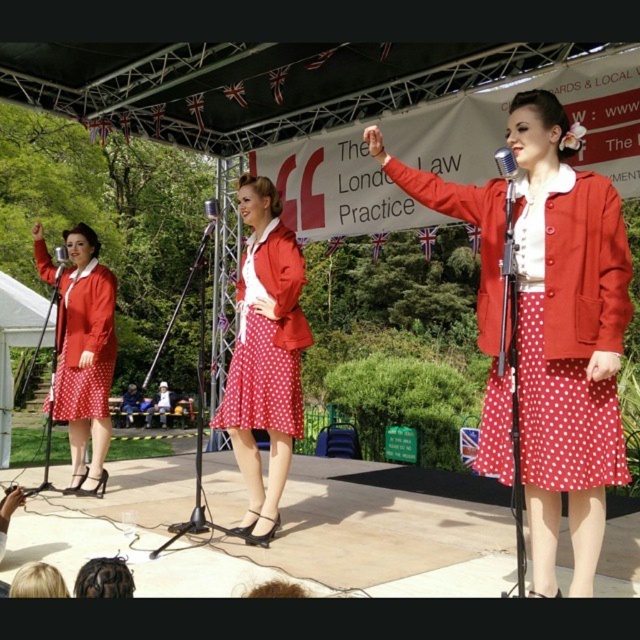
How much distance is there between matte red skirt at left and polka dot fabric dress at center?

matte red skirt at left and polka dot fabric dress at center are 1.65 meters apart.

Is matte red skirt at left wider than polka dot fabric dress at center?

Correct, the width of matte red skirt at left exceeds that of polka dot fabric dress at center.

Where is `matte red skirt at left`? The width and height of the screenshot is (640, 640). matte red skirt at left is located at coordinates (84, 356).

Can you confirm if matte red skirt at left is bigger than metallic silver microphone at upper center?

Yes.

At what (x,y) coordinates should I click in order to perform the action: click on matte red skirt at left. Please return your answer as a coordinate pair (x, y). Image resolution: width=640 pixels, height=640 pixels. Looking at the image, I should click on (84, 356).

Can you confirm if polka dot fabric skirt at center is thinner than metallic silver microphone at upper center?

Incorrect, polka dot fabric skirt at center's width is not less than metallic silver microphone at upper center's.

Which is below, polka dot fabric skirt at center or metallic silver microphone at upper center?

polka dot fabric skirt at center

Does point (499, 536) come behind point (502, 168)?

Yes, point (499, 536) is farther from viewer.

Find the location of a particular element. The width and height of the screenshot is (640, 640). polka dot fabric skirt at center is located at coordinates (381, 524).